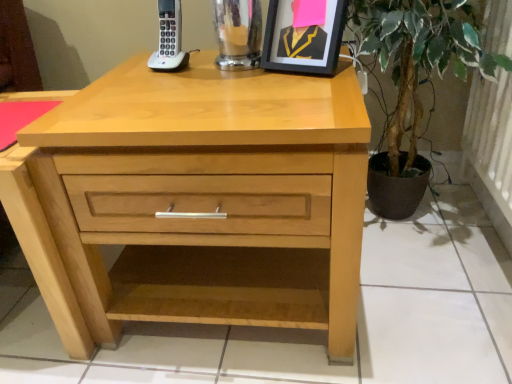
Measure the distance between point (283, 5) and camera.

They are 36.69 inches apart.

At what (x,y) coordinates should I click in order to perform the action: click on natural wood chest of drawers at center. Please return your answer as a coordinate pair (x, y). Image resolution: width=512 pixels, height=384 pixels. Looking at the image, I should click on (195, 177).

The height and width of the screenshot is (384, 512). What are the coordinates of `chest of drawers below the black matte picture frame at upper center (from the image's perspective)` in the screenshot? It's located at (195, 177).

From the image's perspective, between natural wood chest of drawers at center and black matte picture frame at upper center, which one is located above?

black matte picture frame at upper center is shown above in the image.

Which object is closer to the camera taking this photo, natural wood chest of drawers at center or black matte picture frame at upper center?

Positioned in front is natural wood chest of drawers at center.

Is natural wood chest of drawers at center positioned far away from green leafy plant at right?

No.

Is natural wood chest of drawers at center facing away from green leafy plant at right?

That's not correct — natural wood chest of drawers at center is not looking away from green leafy plant at right.

The width and height of the screenshot is (512, 384). I want to click on the chest of drawers that appears in front of the green leafy plant at right, so click(195, 177).

Considering the sizes of objects natural wood chest of drawers at center and green leafy plant at right in the image provided, who is thinner, natural wood chest of drawers at center or green leafy plant at right?

green leafy plant at right.

Looking at this image, is green leafy plant at right outside of black matte picture frame at upper center?

green leafy plant at right lies outside black matte picture frame at upper center's area.

Can you confirm if green leafy plant at right is thinner than black matte picture frame at upper center?

Incorrect, the width of green leafy plant at right is not less than that of black matte picture frame at upper center.

Is green leafy plant at right looking in the opposite direction of black matte picture frame at upper center?

No, green leafy plant at right's orientation is not away from black matte picture frame at upper center.

From a real-world perspective, who is located higher, green leafy plant at right or black matte picture frame at upper center?

black matte picture frame at upper center is physically above.

Which is nearer, [332,65] or [358,43]?

Point [332,65]

Does black matte picture frame at upper center have a greater width compared to green leafy plant at right?

Incorrect, the width of black matte picture frame at upper center does not surpass that of green leafy plant at right.

Is black matte picture frame at upper center to the left of green leafy plant at right from the viewer's perspective?

Yes, black matte picture frame at upper center is to the left of green leafy plant at right.

Is point (304, 52) farther from camera compared to point (130, 104)?

Yes.

Is black matte picture frame at upper center not near natural wood chest of drawers at center?

No, black matte picture frame at upper center is not far away from natural wood chest of drawers at center.

Consider the image. Considering the sizes of black matte picture frame at upper center and natural wood chest of drawers at center in the image, is black matte picture frame at upper center taller or shorter than natural wood chest of drawers at center?

black matte picture frame at upper center is shorter than natural wood chest of drawers at center.

Measure the distance between black matte picture frame at upper center and natural wood chest of drawers at center.

black matte picture frame at upper center is 36.00 centimeters away from natural wood chest of drawers at center.

At what (x,y) coordinates should I click in order to perform the action: click on the chest of drawers that appears below the green leafy plant at right (from a real-world perspective). Please return your answer as a coordinate pair (x, y). Looking at the image, I should click on (195, 177).

Is green leafy plant at right inside or outside of natural wood chest of drawers at center?

The correct answer is: outside.

In terms of width, does green leafy plant at right look wider or thinner when compared to natural wood chest of drawers at center?

Clearly, green leafy plant at right has less width compared to natural wood chest of drawers at center.

At what (x,y) coordinates should I click in order to perform the action: click on the chest of drawers located below the black matte picture frame at upper center (from the image's perspective). Please return your answer as a coordinate pair (x, y). Looking at the image, I should click on (195, 177).

Locate an element on the screen. houseplant that appears above the natural wood chest of drawers at center (from a real-world perspective) is located at coordinates (418, 54).

When comparing their distances from black matte picture frame at upper center, does green leafy plant at right or natural wood chest of drawers at center seem further?

natural wood chest of drawers at center.

Looking at the image, which one is located further to black matte picture frame at upper center, natural wood chest of drawers at center or green leafy plant at right?

Among the two, natural wood chest of drawers at center is located further to black matte picture frame at upper center.

From the picture: Which object lies nearer to the anchor point green leafy plant at right, natural wood chest of drawers at center or black matte picture frame at upper center?

Based on the image, black matte picture frame at upper center appears to be nearer to green leafy plant at right.

Estimate the real-world distances between objects in this image. Which object is further from natural wood chest of drawers at center, green leafy plant at right or black matte picture frame at upper center?

green leafy plant at right.

Looking at the image, which one is located further to green leafy plant at right, black matte picture frame at upper center or natural wood chest of drawers at center?

natural wood chest of drawers at center is positioned further to the anchor green leafy plant at right.

Considering their positions, is black matte picture frame at upper center positioned further to natural wood chest of drawers at center than green leafy plant at right?

green leafy plant at right is positioned further to the anchor natural wood chest of drawers at center.

I want to click on picture frame situated between natural wood chest of drawers at center and green leafy plant at right from left to right, so click(304, 36).